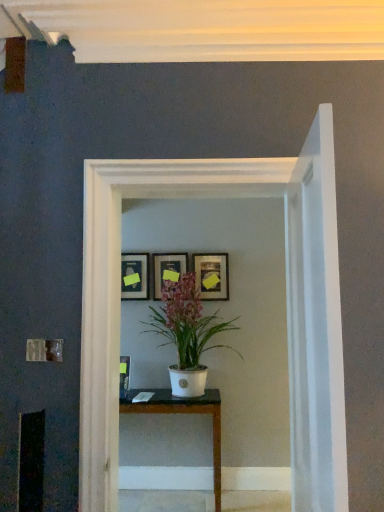
Describe the element at coordinates (187, 332) in the screenshot. I see `white glossy pot at center` at that location.

What do you see at coordinates (167, 268) in the screenshot?
I see `matte black picture frame at center, the second picture frame in the left-to-right sequence` at bounding box center [167, 268].

Find the location of `matte black picture frame at center, the second picture frame in the left-to-right sequence`. matte black picture frame at center, the second picture frame in the left-to-right sequence is located at coordinates (167, 268).

This screenshot has height=512, width=384. What are the coordinates of `matte gold picture frame at center, the first picture frame viewed from the right` in the screenshot? It's located at (212, 276).

Where is `white glossy pot at center`? This screenshot has height=512, width=384. white glossy pot at center is located at coordinates (187, 332).

Is matte black picture frame at upper center, positioned as the first picture frame in left-to-right order, inside white glossy table at center?

That's incorrect, matte black picture frame at upper center, positioned as the first picture frame in left-to-right order, is not inside white glossy table at center.

Between white glossy table at center and matte black picture frame at upper center, marked as the third picture frame in a right-to-left arrangement, which one appears on the left side from the viewer's perspective?

matte black picture frame at upper center, marked as the third picture frame in a right-to-left arrangement.

Is point (196, 404) closer or farther from the camera than point (139, 294)?

Point (196, 404).

Does white glossy table at center come behind matte black picture frame at upper center, positioned as the first picture frame in left-to-right order?

That is False.

From a real-world perspective, which is physically below, matte gold picture frame at center, the first picture frame viewed from the right, or white glossy pot at center?

white glossy pot at center is physically lower.

Is the depth of matte gold picture frame at center, acting as the third picture frame starting from the left, less than that of white glossy pot at center?

No, it is not.

The width and height of the screenshot is (384, 512). In order to click on the 3rd picture frame above the white glossy pot at center (from the image's perspective) in this screenshot , I will do `click(212, 276)`.

Is white glossy glass door at center aimed at white glossy pot at center?

No, white glossy glass door at center is not facing towards white glossy pot at center.

Between white glossy glass door at center and white glossy pot at center, which one has smaller width?

Thinner between the two is white glossy glass door at center.

Between white glossy glass door at center and white glossy pot at center, which one has smaller size?

white glossy glass door at center is smaller.

Between white glossy glass door at center and matte black picture frame at center, which is counted as the 2th picture frame, starting from the right, which one has smaller width?

With smaller width is matte black picture frame at center, which is counted as the 2th picture frame, starting from the right.

Between white glossy glass door at center and matte black picture frame at center, the second picture frame in the left-to-right sequence, which one has less height?

matte black picture frame at center, the second picture frame in the left-to-right sequence, is shorter.

Is matte black picture frame at center, the second picture frame in the left-to-right sequence, at the back of white glossy glass door at center?

Yes, white glossy glass door at center is facing away from matte black picture frame at center, the second picture frame in the left-to-right sequence.

Are white glossy glass door at center and matte black picture frame at center, which is counted as the 2th picture frame, starting from the right, beside each other?

white glossy glass door at center and matte black picture frame at center, which is counted as the 2th picture frame, starting from the right, are clearly separated.

Considering the sizes of objects matte black picture frame at center, the second picture frame in the left-to-right sequence, and matte black picture frame at upper center, positioned as the first picture frame in left-to-right order, in the image provided, who is bigger, matte black picture frame at center, the second picture frame in the left-to-right sequence, or matte black picture frame at upper center, positioned as the first picture frame in left-to-right order,?

With larger size is matte black picture frame at center, the second picture frame in the left-to-right sequence.

Looking at this image, considering the relative sizes of matte black picture frame at center, the second picture frame in the left-to-right sequence, and matte black picture frame at upper center, marked as the third picture frame in a right-to-left arrangement, in the image provided, is matte black picture frame at center, the second picture frame in the left-to-right sequence, taller than matte black picture frame at upper center, marked as the third picture frame in a right-to-left arrangement,?

Indeed, matte black picture frame at center, the second picture frame in the left-to-right sequence, has a greater height compared to matte black picture frame at upper center, marked as the third picture frame in a right-to-left arrangement.

Would you say matte black picture frame at center, which is counted as the 2th picture frame, starting from the right, contains matte black picture frame at upper center, marked as the third picture frame in a right-to-left arrangement?

No, matte black picture frame at center, which is counted as the 2th picture frame, starting from the right, does not contain matte black picture frame at upper center, marked as the third picture frame in a right-to-left arrangement.

Is matte black picture frame at center, which is counted as the 2th picture frame, starting from the right, positioned in front of matte black picture frame at upper center, marked as the third picture frame in a right-to-left arrangement?

Yes, matte black picture frame at center, which is counted as the 2th picture frame, starting from the right, is closer to the camera.

What's the angular difference between white glossy glass door at center and white glossy table at center's facing directions?

The angular difference between white glossy glass door at center and white glossy table at center is 1.08 degrees.

Looking at the image, does white glossy glass door at center seem bigger or smaller compared to white glossy table at center?

white glossy glass door at center is bigger than white glossy table at center.

Is white glossy glass door at center oriented away from white glossy table at center?

Yes, white glossy glass door at center is positioned with its back facing white glossy table at center.

Does white glossy glass door at center appear on the right side of white glossy table at center?

Yes.

Which is closer to the camera, (170,372) or (208,277)?

Point (170,372).

In terms of size, does white glossy pot at center appear bigger or smaller than matte gold picture frame at center, acting as the third picture frame starting from the left?

Considering their sizes, white glossy pot at center takes up more space than matte gold picture frame at center, acting as the third picture frame starting from the left.

Is matte gold picture frame at center, acting as the third picture frame starting from the left, completely or partially inside white glossy pot at center?

Actually, matte gold picture frame at center, acting as the third picture frame starting from the left, is outside white glossy pot at center.

Looking at this image, is white glossy pot at center looking in the opposite direction of matte gold picture frame at center, the first picture frame viewed from the right?

Yes, white glossy pot at center is positioned with its back facing matte gold picture frame at center, the first picture frame viewed from the right.

At what (x,y) coordinates should I click in order to perform the action: click on table lying on the right of matte black picture frame at upper center, marked as the third picture frame in a right-to-left arrangement. Please return your answer as a coordinate pair (x, y). Looking at the image, I should click on click(x=183, y=413).

Find the location of a particular element. houseplant that is on the left side of matte gold picture frame at center, acting as the third picture frame starting from the left is located at coordinates (187, 332).

Looking at the image, which one is located closer to matte black picture frame at center, the second picture frame in the left-to-right sequence, white glossy glass door at center or white glossy pot at center?

white glossy pot at center is closer to matte black picture frame at center, the second picture frame in the left-to-right sequence.

From the image, which object appears to be farther from matte black picture frame at center, which is counted as the 2th picture frame, starting from the right, matte gold picture frame at center, the first picture frame viewed from the right, or white glossy glass door at center?

white glossy glass door at center is further to matte black picture frame at center, which is counted as the 2th picture frame, starting from the right.

Estimate the real-world distances between objects in this image. Which object is further from white glossy glass door at center, white glossy table at center or matte gold picture frame at center, acting as the third picture frame starting from the left?

matte gold picture frame at center, acting as the third picture frame starting from the left, lies further to white glossy glass door at center than the other object.

Considering their positions, is matte gold picture frame at center, the first picture frame viewed from the right, positioned further to white glossy table at center than matte black picture frame at center, which is counted as the 2th picture frame, starting from the right?

Based on the image, matte black picture frame at center, which is counted as the 2th picture frame, starting from the right, appears to be further to white glossy table at center.

When comparing their distances from matte black picture frame at upper center, marked as the third picture frame in a right-to-left arrangement, does white glossy table at center or matte gold picture frame at center, the first picture frame viewed from the right, seem further?

Based on the image, white glossy table at center appears to be further to matte black picture frame at upper center, marked as the third picture frame in a right-to-left arrangement.

Based on their spatial positions, is white glossy table at center or white glossy glass door at center further from white glossy pot at center?

Based on the image, white glossy glass door at center appears to be further to white glossy pot at center.

From the image, which object appears to be farther from white glossy pot at center, matte black picture frame at upper center, positioned as the first picture frame in left-to-right order, or white glossy table at center?

Based on the image, matte black picture frame at upper center, positioned as the first picture frame in left-to-right order, appears to be further to white glossy pot at center.

Which object lies further to the anchor point white glossy table at center, matte black picture frame at center, the second picture frame in the left-to-right sequence, or white glossy pot at center?

matte black picture frame at center, the second picture frame in the left-to-right sequence, is further to white glossy table at center.

Identify the location of houseplant between white glossy glass door at center and matte black picture frame at center, which is counted as the 2th picture frame, starting from the right, from front to back. The width and height of the screenshot is (384, 512). (187, 332).

Find the location of a particular element. houseplant positioned between white glossy glass door at center and matte gold picture frame at center, acting as the third picture frame starting from the left, from near to far is located at coordinates (187, 332).

Locate an element on the screen. picture frame between matte black picture frame at upper center, positioned as the first picture frame in left-to-right order, and matte gold picture frame at center, acting as the third picture frame starting from the left is located at coordinates (167, 268).

You are a GUI agent. You are given a task and a screenshot of the screen. Output one action in this format:
    pyautogui.click(x=<x>, y=<y>)
    Task: Click on the houseplant between matte black picture frame at upper center, marked as the third picture frame in a right-to-left arrangement, and white glossy table at center from top to bottom
    This screenshot has width=384, height=512.
    Given the screenshot: What is the action you would take?
    pyautogui.click(x=187, y=332)